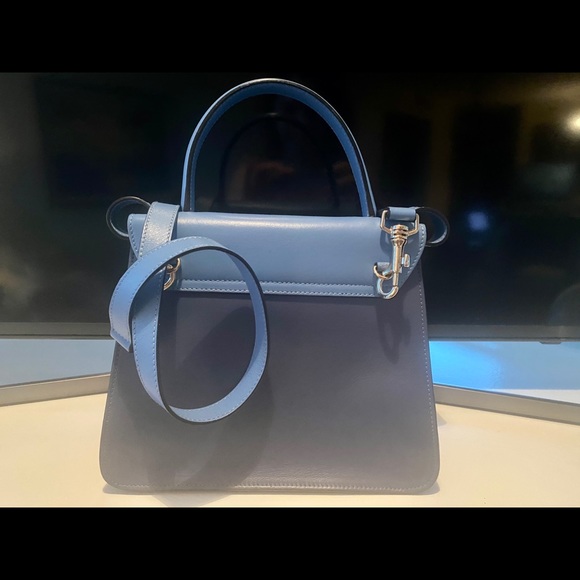
I want to click on window, so click(x=478, y=155).